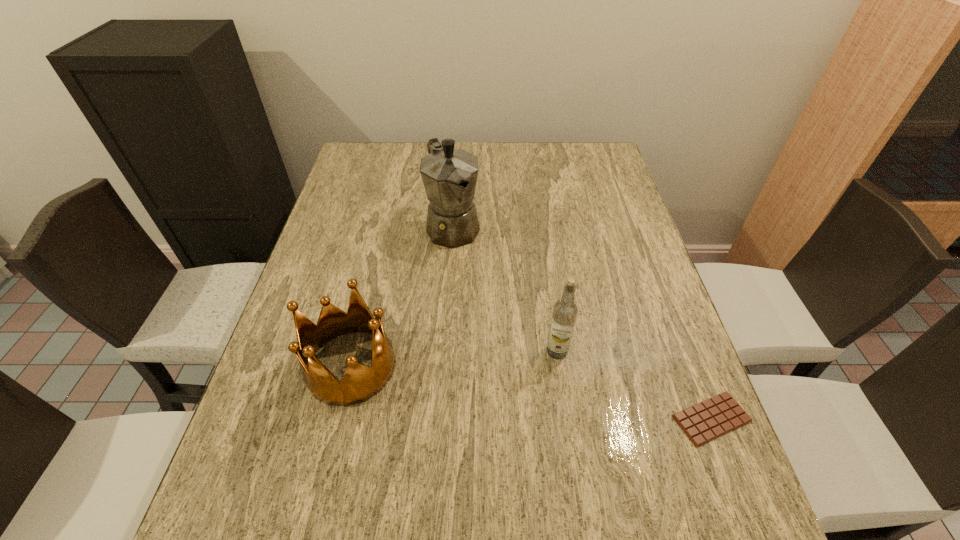
Find the location of `vacant region located 0.060m on the pouring side of the second object from left to right`. vacant region located 0.060m on the pouring side of the second object from left to right is located at coordinates (472, 266).

Find the location of a particular element. Image resolution: width=960 pixels, height=540 pixels. vacant space located on the pouring side of the second object from left to right is located at coordinates (511, 327).

This screenshot has width=960, height=540. What are the coordinates of `free space located 0.400m on the pouring side of the second object from left to right` in the screenshot? It's located at (537, 368).

Locate an element on the screen. Image resolution: width=960 pixels, height=540 pixels. vacant space located on the label of the third object from left to right is located at coordinates (424, 402).

The height and width of the screenshot is (540, 960). Identify the location of vacant space located on the label of the third object from left to right. (381, 418).

You are a GUI agent. You are given a task and a screenshot of the screen. Output one action in this format:
    pyautogui.click(x=<x>, y=<y>)
    Task: Click on the free space located on the label of the third object from left to right
    This screenshot has width=960, height=540.
    Given the screenshot: What is the action you would take?
    pyautogui.click(x=375, y=420)

Where is `object that is positioned at the near edge`? object that is positioned at the near edge is located at coordinates (714, 417).

Locate an element on the screen. This screenshot has height=540, width=960. object positioned at the left edge is located at coordinates (359, 383).

Locate an element on the screen. object present at the right edge is located at coordinates (714, 417).

Find the location of a particular element. This screenshot has width=960, height=540. object that is at the near right corner is located at coordinates (714, 417).